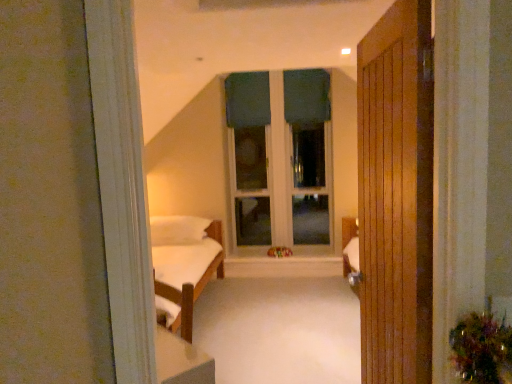
Question: Does point (289, 188) appear closer or farther from the camera than point (231, 84)?

Choices:
 (A) farther
 (B) closer

Answer: (B)

Question: Choose the correct answer: Is teal fabric window at center inside green fabric curtain at center, which is the second curtain in right-to-left order, or outside it?

Choices:
 (A) outside
 (B) inside

Answer: (A)

Question: Estimate the real-world distances between objects in this image. Which object is farther from the teal fabric window at center?

Choices:
 (A) white soft pillow at center
 (B) green fabric curtain at center, which is the second curtain in right-to-left order
 (C) plush yellow teddy bear at center
 (D) dark green fabric curtain at upper center, which is the second curtain in left-to-right order
 (E) wooden door at right

Answer: (E)

Question: Which object is the farthest from the plush yellow teddy bear at center?

Choices:
 (A) green fabric curtain at center, which is the second curtain in right-to-left order
 (B) white soft pillow at center
 (C) teal fabric window at center
 (D) dark green fabric curtain at upper center, which is the first curtain from right to left
 (E) wooden door at right

Answer: (E)